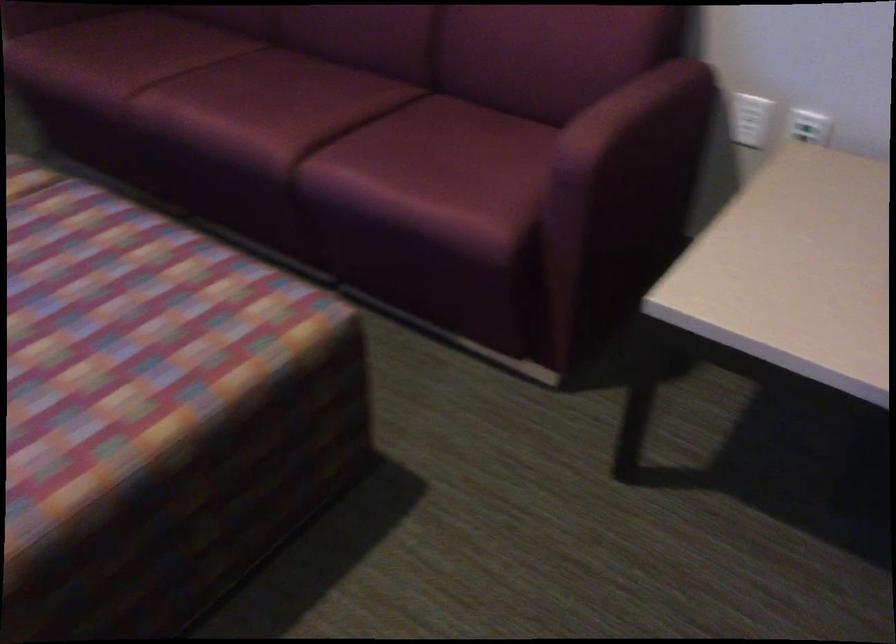
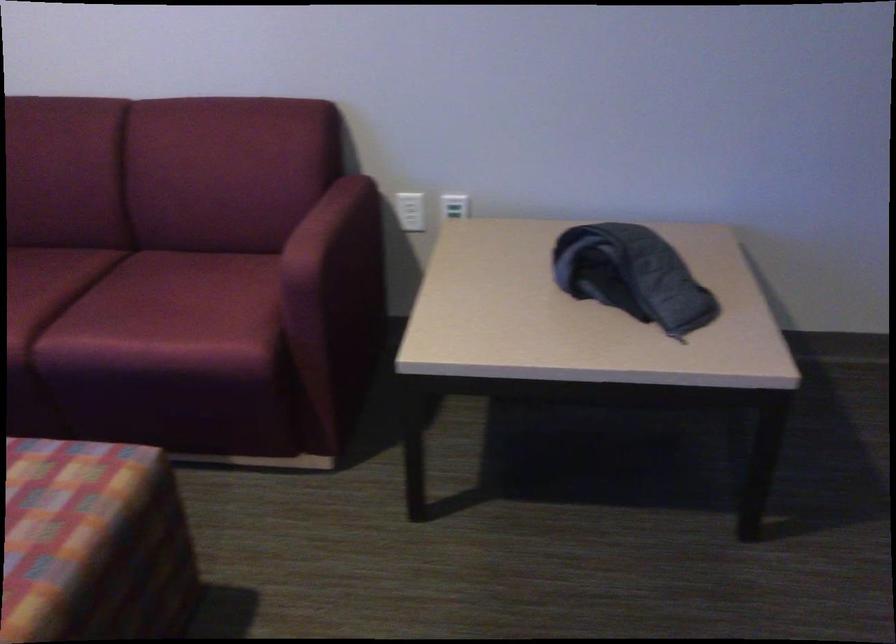
In a continuous first-person perspective shot, in which direction is the camera moving?

The cameraman walked toward left, backward.